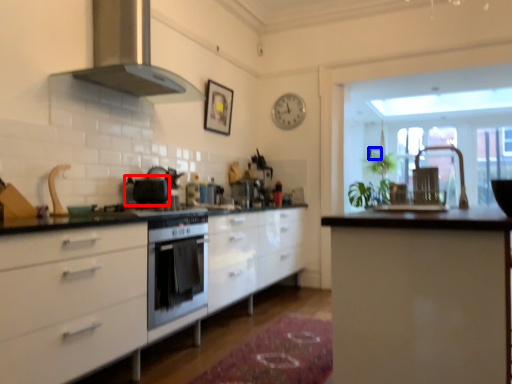
Question: Which object appears farthest to the camera in this image, appliance (highlighted by a red box) or picture frame (highlighted by a blue box)?

Choices:
 (A) appliance
 (B) picture frame

Answer: (B)